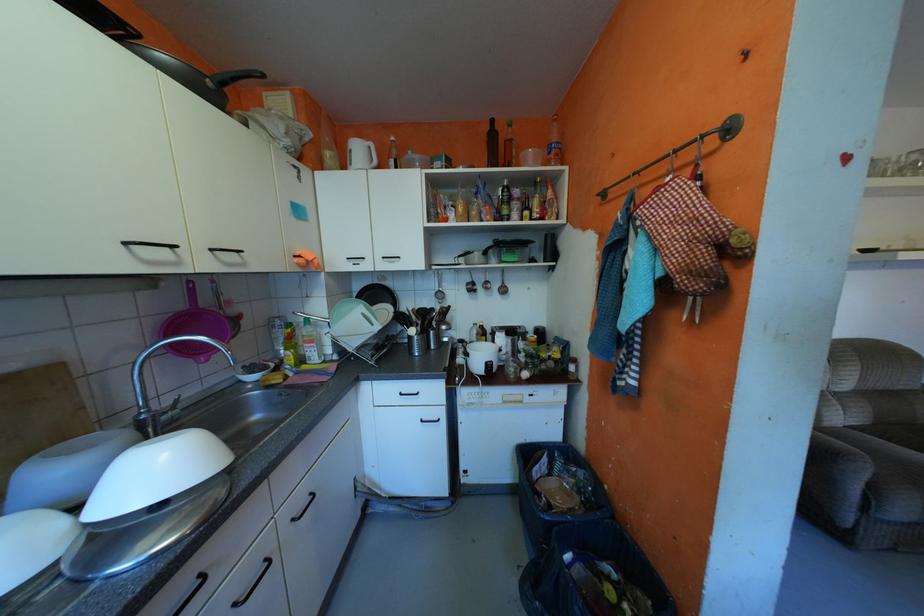
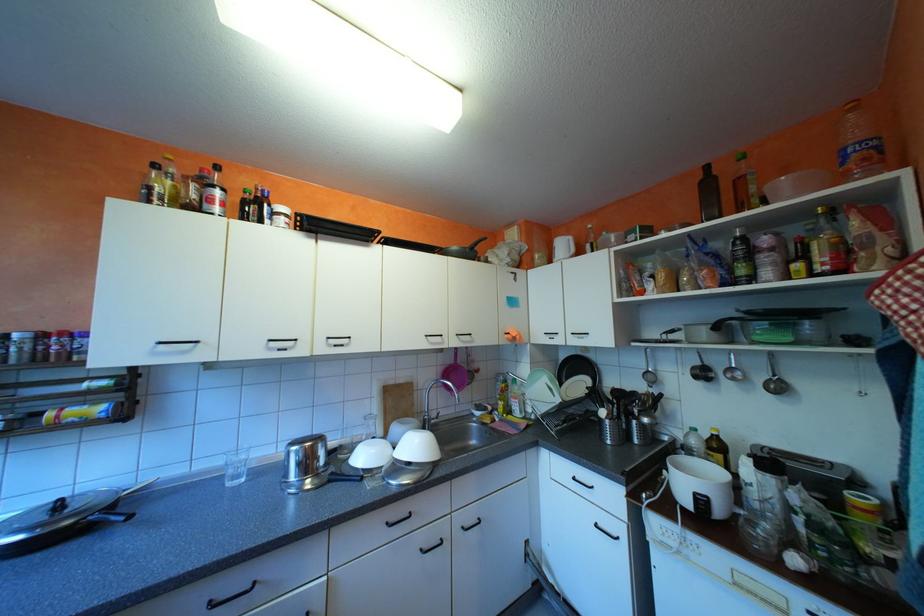
In the second image, find the point that corresponds to pixel 517 333 in the first image.

(771, 464)